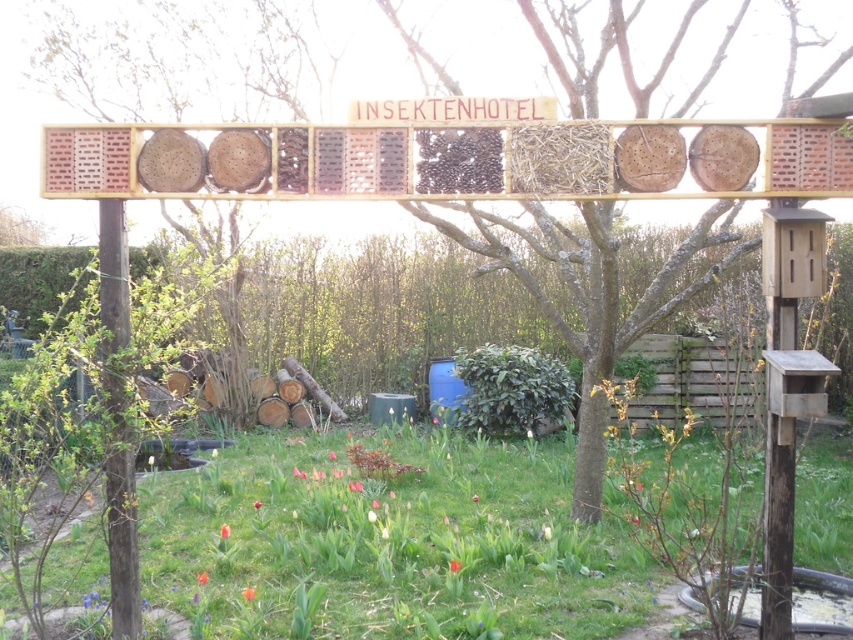
You are a GUI agent. You are given a task and a screenshot of the screen. Output one action in this format:
    pyautogui.click(x=<x>, y=<y>)
    Task: Click on the green grass at lower center
    This screenshot has width=853, height=640.
    Given the screenshot: What is the action you would take?
    pyautogui.click(x=387, y=544)

Between green grass at lower center and brown textured wood at center, which one has less height?

brown textured wood at center is shorter.

Describe the element at coordinates (387, 544) in the screenshot. I see `green grass at lower center` at that location.

I want to click on green grass at lower center, so click(387, 544).